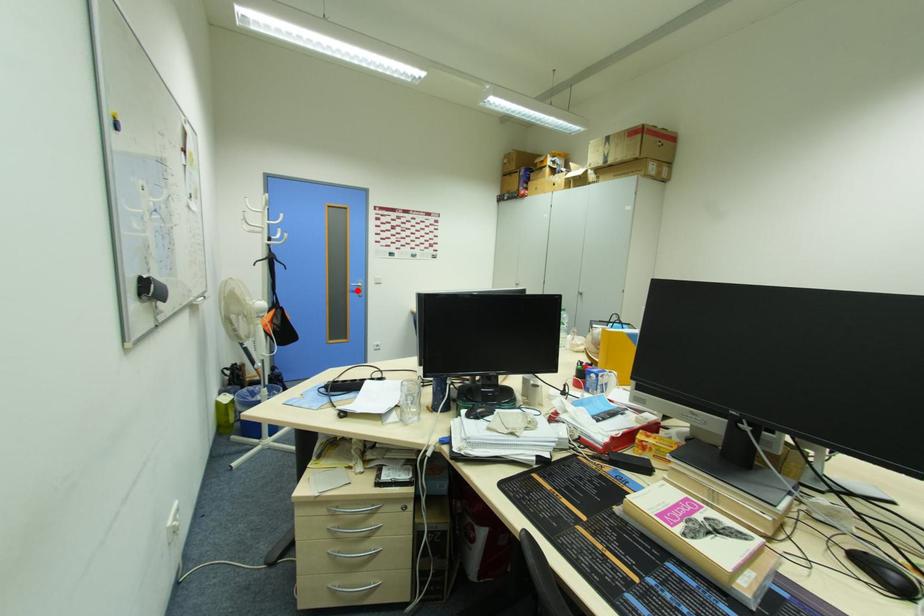
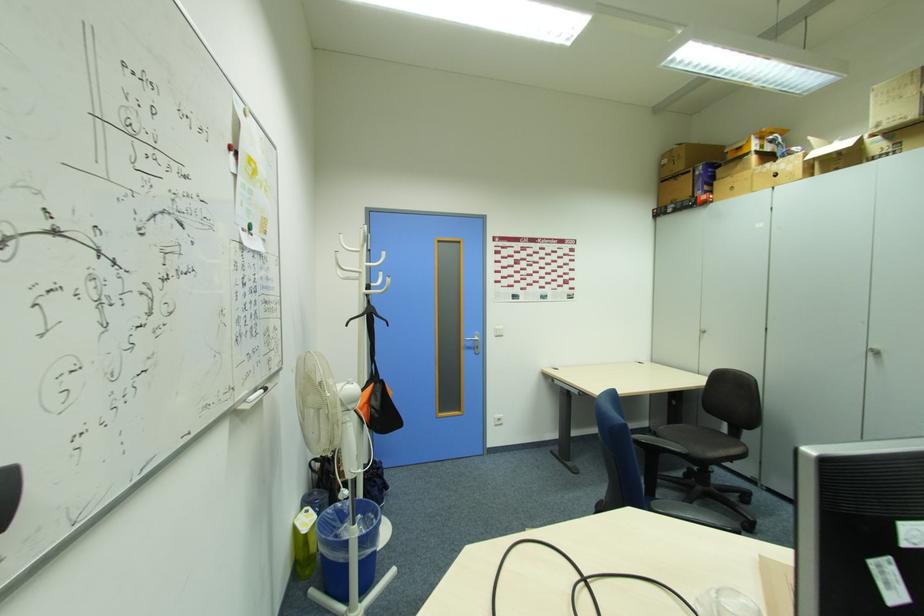
In the second image, find the point that corresponds to the highlighted location in the first image.

(472, 346)